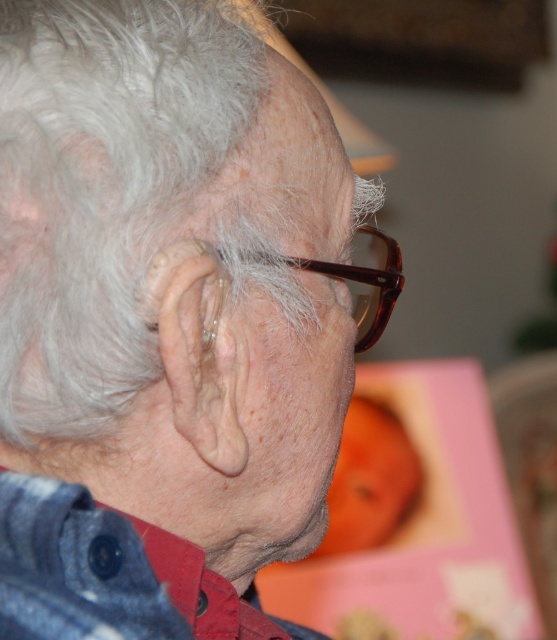
You are a optometrist examining a patient. You notice two pairs of glasses on the table in front of you. The matte brown glasses at center and the brown tortoiseshell glasses at center. The patient needs to choose a pair that is closer to their face. Which pair should they choose?

The matte brown glasses at center is 3.59 inches away from brown tortoiseshell glasses at center. Since the patient needs a pair closer to their face, they should choose the matte brown glasses at center as it is positioned closer compared to the brown tortoiseshell glasses at center.

You are a photographer trying to capture a close up of the elderly person in the image. The matte brown glasses at center are in focus. Where should you adjust your focus to capture the pink gift box in the background?

The pink gift box in the background is blurred, so you should adjust the focus to a point further away from the camera than the matte brown glasses at center to capture it clearly.